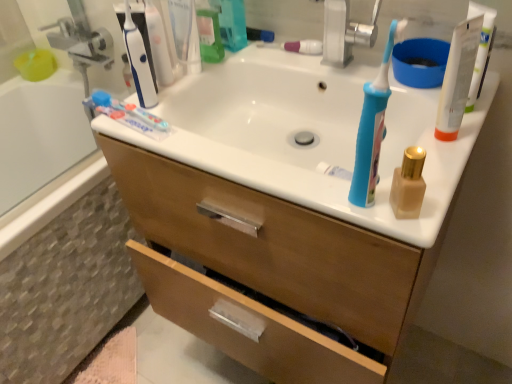
The height and width of the screenshot is (384, 512). I want to click on free space to the left of pink glossy toothpaste at center, the 1th toothpaste from the right, so click(x=245, y=57).